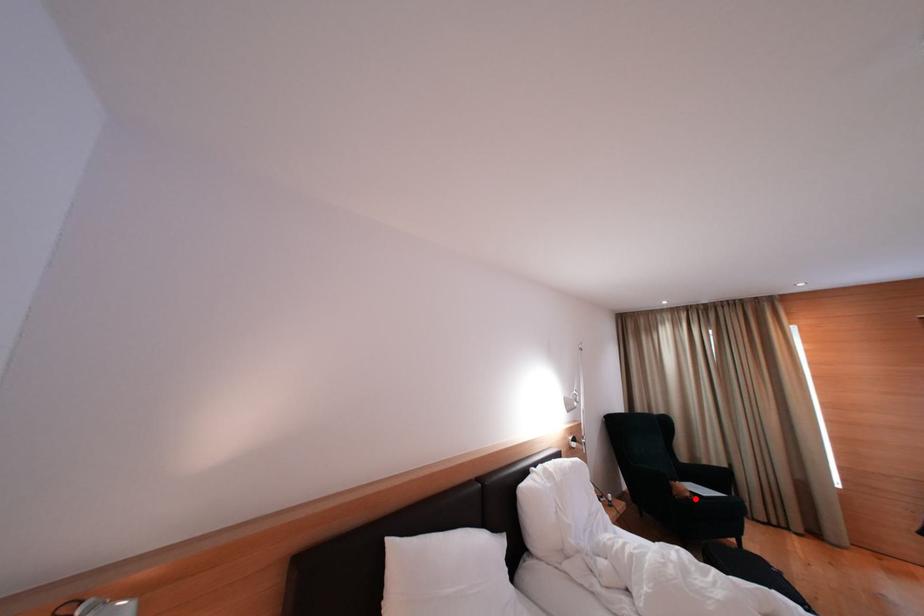
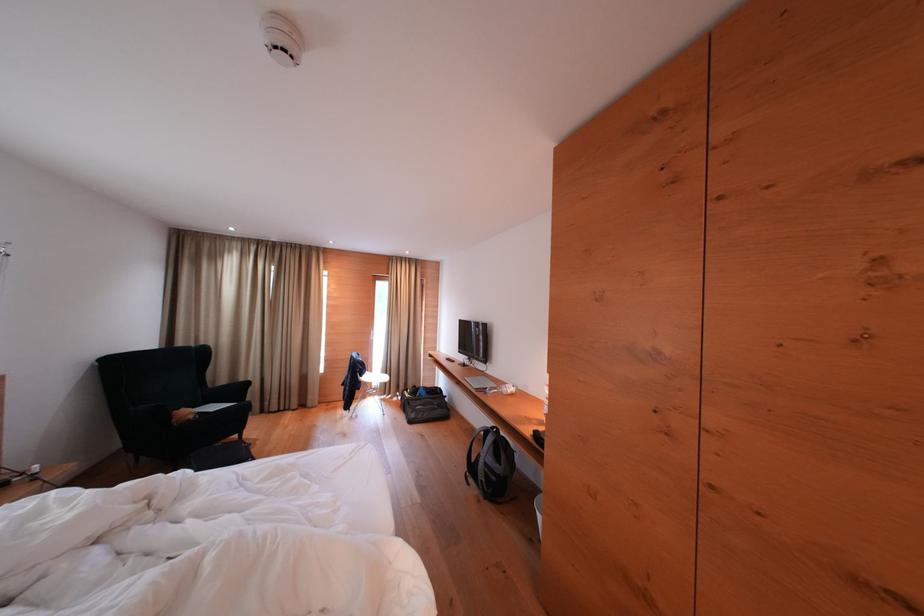
In the second image, find the point that corresponds to the highlighted location in the first image.

(198, 421)